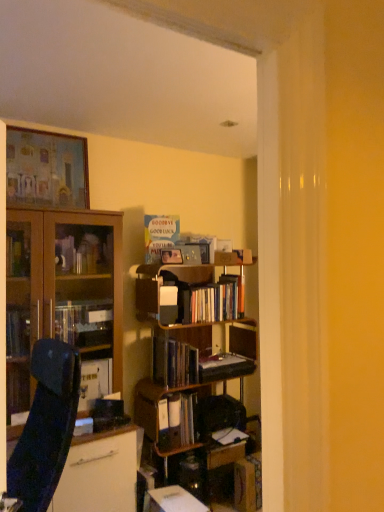
Question: From the image's perspective, is wooden bookcase at center over hardcover books at center, which ranks as the fourth book in bottom-to-top order?

Choices:
 (A) yes
 (B) no

Answer: (B)

Question: Does wooden bookcase at center have a greater height compared to hardcover books at center, which ranks as the fourth book in bottom-to-top order?

Choices:
 (A) no
 (B) yes

Answer: (B)

Question: Can you confirm if wooden bookcase at center is positioned to the right of hardcover books at center, which ranks as the fourth book in bottom-to-top order?

Choices:
 (A) yes
 (B) no

Answer: (B)

Question: From a real-world perspective, is wooden bookcase at center over hardcover books at center, placed as the 2th book when sorted from top to bottom?

Choices:
 (A) no
 (B) yes

Answer: (A)

Question: Is wooden bookcase at center looking in the opposite direction of hardcover books at center, which ranks as the fourth book in bottom-to-top order?

Choices:
 (A) no
 (B) yes

Answer: (B)

Question: Considering the relative positions of hardcover book at center, the third book from the top, and hardcover book at center in the image provided, is hardcover book at center, the third book from the top, to the left or to the right of hardcover book at center?

Choices:
 (A) left
 (B) right

Answer: (A)

Question: Is point (172, 344) positioned closer to the camera than point (213, 373)?

Choices:
 (A) farther
 (B) closer

Answer: (B)

Question: Is hardcover book at center, placed as the 3th book when sorted from bottom to top, in front of or behind hardcover book at center in the image?

Choices:
 (A) behind
 (B) front

Answer: (B)

Question: From a real-world perspective, is hardcover book at center, the third book from the top, above or below hardcover book at center?

Choices:
 (A) below
 (B) above

Answer: (B)

Question: Considering the positions of hardcover book at center, the second book from the bottom, and wooden bookcase at center in the image, is hardcover book at center, the second book from the bottom, wider or thinner than wooden bookcase at center?

Choices:
 (A) thin
 (B) wide

Answer: (A)

Question: Relative to wooden bookcase at center, is hardcover book at center, the second book from the bottom, in front or behind?

Choices:
 (A) behind
 (B) front

Answer: (A)

Question: Considering the positions of point pyautogui.click(x=187, y=400) and point pyautogui.click(x=200, y=309), is point pyautogui.click(x=187, y=400) closer or farther from the camera than point pyautogui.click(x=200, y=309)?

Choices:
 (A) farther
 (B) closer

Answer: (B)

Question: Is hardcover book at center, which is counted as the fourth book, starting from the top, situated inside wooden bookcase at center or outside?

Choices:
 (A) inside
 (B) outside

Answer: (A)

Question: From a real-world perspective, is matte wooden picture frame at upper left above or below wooden bookcase at center?

Choices:
 (A) above
 (B) below

Answer: (A)

Question: Visually, is matte wooden picture frame at upper left positioned to the left or to the right of wooden bookcase at center?

Choices:
 (A) right
 (B) left

Answer: (B)